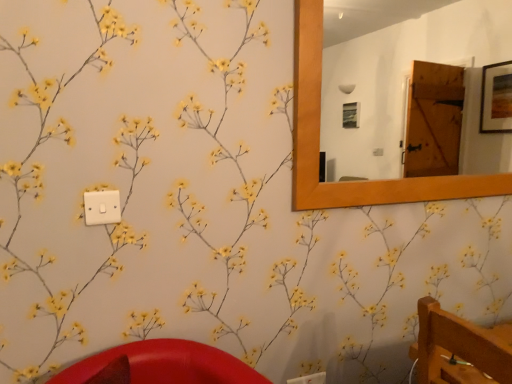
Question: Considering their positions, is white plastic light switch at upper left located in front of or behind wooden frame mirror at upper right?

Choices:
 (A) behind
 (B) front

Answer: (B)

Question: In terms of size, does white plastic light switch at upper left appear bigger or smaller than wooden frame mirror at upper right?

Choices:
 (A) big
 (B) small

Answer: (B)

Question: Does point (96, 203) appear closer or farther from the camera than point (352, 46)?

Choices:
 (A) closer
 (B) farther

Answer: (A)

Question: Is wooden frame mirror at upper right to the left or to the right of white plastic light switch at upper left in the image?

Choices:
 (A) left
 (B) right

Answer: (B)

Question: From the image's perspective, is wooden frame mirror at upper right above or below white plastic light switch at upper left?

Choices:
 (A) above
 (B) below

Answer: (A)

Question: Based on their sizes in the image, would you say wooden frame mirror at upper right is bigger or smaller than white plastic light switch at upper left?

Choices:
 (A) small
 (B) big

Answer: (B)

Question: Is wooden frame mirror at upper right wider or thinner than white plastic light switch at upper left?

Choices:
 (A) thin
 (B) wide

Answer: (B)